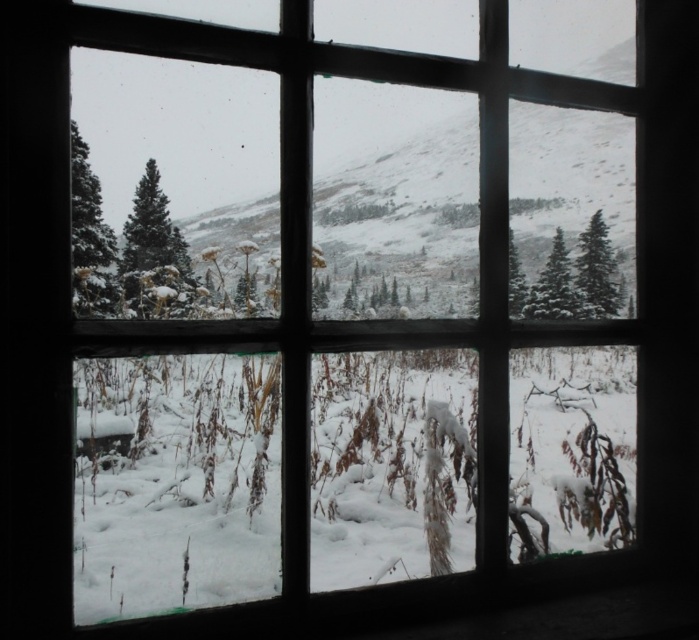
Question: Which object appears closest to the camera in this image?

Choices:
 (A) green matte tree at center-right
 (B) green matte tree at left

Answer: (B)

Question: Which of these objects is positioned farthest from the green matte tree at center-right?

Choices:
 (A) green matte tree at right
 (B) green matte tree at left

Answer: (B)

Question: Can you confirm if green matte tree at center is positioned to the right of green matte tree at right?

Choices:
 (A) no
 (B) yes

Answer: (A)

Question: Does green matte tree at left come behind green matte tree at center-right?

Choices:
 (A) yes
 (B) no

Answer: (B)

Question: Which of the following is the closest to the observer?

Choices:
 (A) (99, 186)
 (B) (164, 273)
 (C) (577, 266)
 (D) (565, 268)

Answer: (B)

Question: From the image, what is the correct spatial relationship of green matte tree at left in relation to green matte tree at center?

Choices:
 (A) below
 (B) above

Answer: (B)